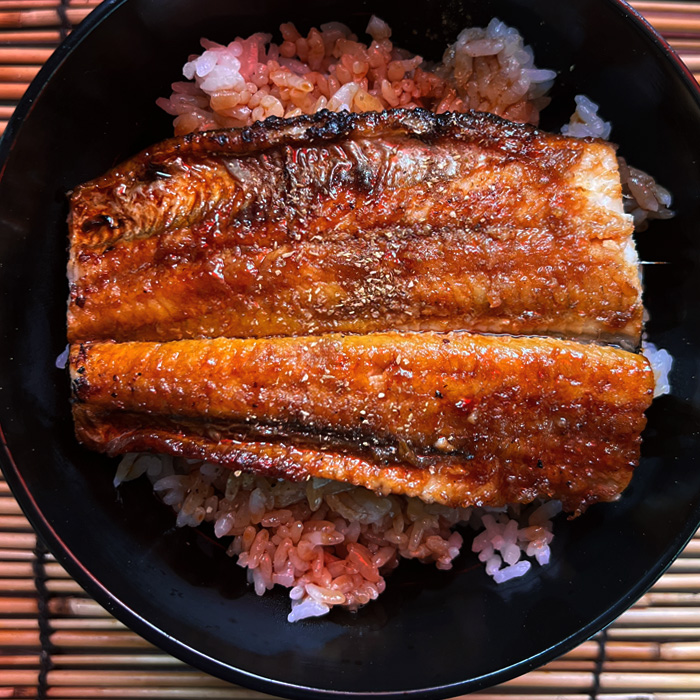
What are the coordinates of `1 bamboo place mat` in the screenshot? It's located at (654, 652).